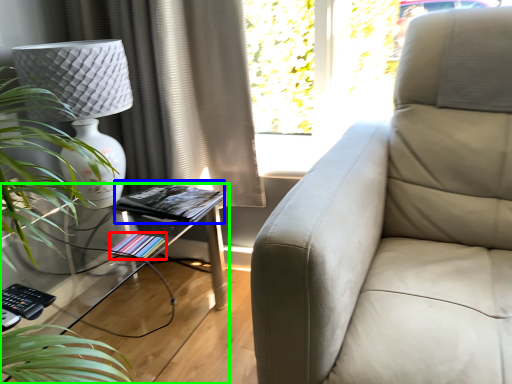
Question: Based on their relative distances, which object is farther from book (highlighted by a red box)? Choose from book (highlighted by a blue box) and table (highlighted by a green box).

Choices:
 (A) book
 (B) table

Answer: (B)